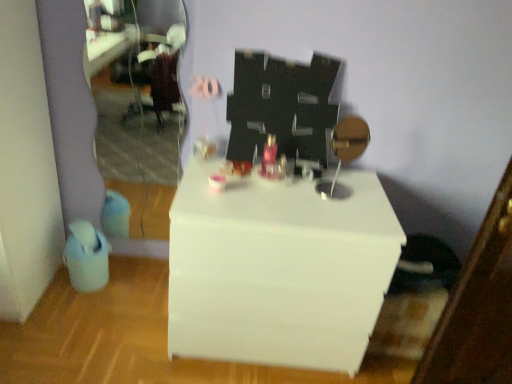
Question: Is clear glass mirror at left aimed at white glossy table at center?

Choices:
 (A) yes
 (B) no

Answer: (B)

Question: Is clear glass mirror at left facing away from white glossy table at center?

Choices:
 (A) yes
 (B) no

Answer: (B)

Question: From a real-world perspective, is clear glass mirror at left physically above white glossy table at center?

Choices:
 (A) no
 (B) yes

Answer: (B)

Question: Considering the relative sizes of clear glass mirror at left and white glossy table at center in the image provided, is clear glass mirror at left bigger than white glossy table at center?

Choices:
 (A) yes
 (B) no

Answer: (B)

Question: Considering the relative sizes of clear glass mirror at left and white glossy table at center in the image provided, is clear glass mirror at left taller than white glossy table at center?

Choices:
 (A) yes
 (B) no

Answer: (A)

Question: From the image's perspective, is clear glass mirror at left on top of white glossy table at center?

Choices:
 (A) no
 (B) yes

Answer: (B)

Question: Can you confirm if white glossy table at center is bigger than clear glass mirror at left?

Choices:
 (A) no
 (B) yes

Answer: (B)

Question: Can you confirm if white glossy table at center is thinner than clear glass mirror at left?

Choices:
 (A) yes
 (B) no

Answer: (B)

Question: From a real-world perspective, is white glossy table at center located higher than clear glass mirror at left?

Choices:
 (A) no
 (B) yes

Answer: (A)

Question: From the image's perspective, is white glossy table at center located beneath clear glass mirror at left?

Choices:
 (A) yes
 (B) no

Answer: (A)

Question: Can you see white glossy table at center touching clear glass mirror at left?

Choices:
 (A) yes
 (B) no

Answer: (B)

Question: From a real-world perspective, is white glossy table at center below clear glass mirror at left?

Choices:
 (A) yes
 (B) no

Answer: (A)

Question: Is point (136, 66) positioned closer to the camera than point (225, 248)?

Choices:
 (A) closer
 (B) farther

Answer: (B)